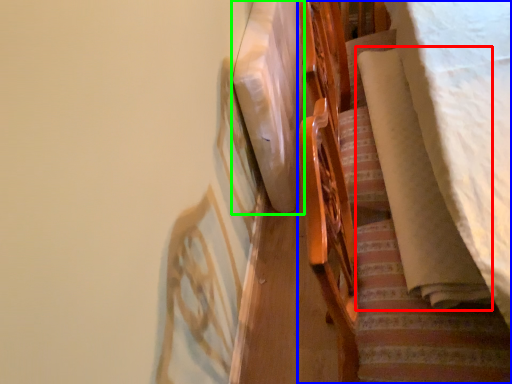
Question: Which object is the closest to the blanket (highlighted by a red box)? Choose among these: furniture (highlighted by a blue box) or linen (highlighted by a green box).

Choices:
 (A) furniture
 (B) linen

Answer: (A)